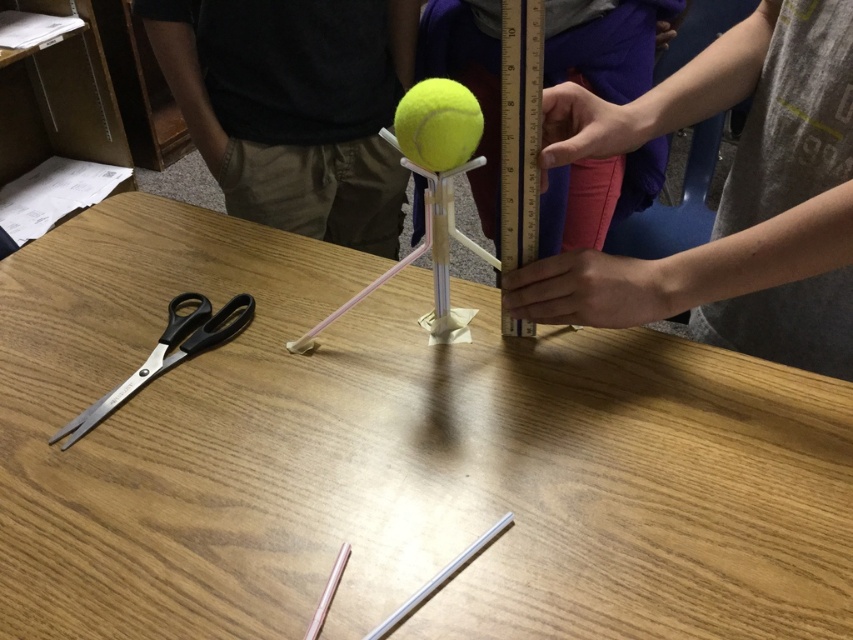
What object is located at the coordinates point (421,253)?

The yellow rubber tennis ball at center is located at point (421,253).

You are standing in front of the table where the experiment is set up. You need to place a new object exactly where the gray cotton shirt at upper right is currently located. Is this position on the table or somewhere else?

The gray cotton shirt at upper right is located at point coordinates (x=729, y=196). Since the scene description mentions the shirt is at upper right, which is part of the background area with shelves and people, it is not on the table where the experiment is taking place. Therefore, placing the new object there would be off the table in the background.

You are a student observing the experiment setup on the wooden table. You notice two yellow tennis balls at the center. Which one is closer to you, the yellow rubber tennis ball at center or the yellow matte tennis ball at center?

The yellow rubber tennis ball at center is closer to you because the yellow matte tennis ball at center is positioned behind it.